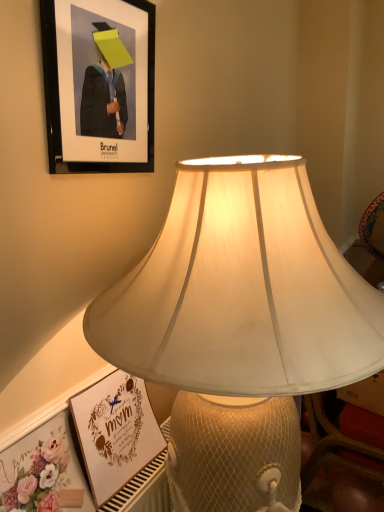
Question: Could you tell me if floral paper at lower left is facing matte white frame at lower left, the 1th picture frame when ordered from bottom to top?

Choices:
 (A) no
 (B) yes

Answer: (A)

Question: Is floral paper at lower left positioned before matte white frame at lower left, the 1th picture frame when ordered from bottom to top?

Choices:
 (A) no
 (B) yes

Answer: (B)

Question: From a real-world perspective, is floral paper at lower left below matte white frame at lower left, marked as the 2th picture frame in a top-to-bottom arrangement?

Choices:
 (A) yes
 (B) no

Answer: (A)

Question: From a real-world perspective, is floral paper at lower left over matte white frame at lower left, marked as the 2th picture frame in a top-to-bottom arrangement?

Choices:
 (A) yes
 (B) no

Answer: (B)

Question: Considering the relative positions of floral paper at lower left and matte white frame at lower left, marked as the 2th picture frame in a top-to-bottom arrangement, in the image provided, is floral paper at lower left to the right of matte white frame at lower left, marked as the 2th picture frame in a top-to-bottom arrangement, from the viewer's perspective?

Choices:
 (A) no
 (B) yes

Answer: (A)

Question: From the image's perspective, is floral paper at lower left on top of matte white frame at lower left, the 1th picture frame when ordered from bottom to top?

Choices:
 (A) yes
 (B) no

Answer: (B)

Question: Is black matte picture frame at upper left, marked as the 1th picture frame in a top-to-bottom arrangement, shorter than matte white frame at lower left, marked as the 2th picture frame in a top-to-bottom arrangement?

Choices:
 (A) no
 (B) yes

Answer: (A)

Question: From the image's perspective, is black matte picture frame at upper left, marked as the 2th picture frame in a bottom-to-top arrangement, beneath matte white frame at lower left, marked as the 2th picture frame in a top-to-bottom arrangement?

Choices:
 (A) no
 (B) yes

Answer: (A)

Question: Is black matte picture frame at upper left, marked as the 2th picture frame in a bottom-to-top arrangement, oriented towards matte white frame at lower left, marked as the 2th picture frame in a top-to-bottom arrangement?

Choices:
 (A) no
 (B) yes

Answer: (A)

Question: Is matte white frame at lower left, the 1th picture frame when ordered from bottom to top, completely or partially inside black matte picture frame at upper left, marked as the 1th picture frame in a top-to-bottom arrangement?

Choices:
 (A) yes
 (B) no

Answer: (B)

Question: Is black matte picture frame at upper left, marked as the 2th picture frame in a bottom-to-top arrangement, closer to camera compared to matte white frame at lower left, the 1th picture frame when ordered from bottom to top?

Choices:
 (A) yes
 (B) no

Answer: (A)

Question: Is there a large distance between black matte picture frame at upper left, marked as the 1th picture frame in a top-to-bottom arrangement, and matte white frame at lower left, marked as the 2th picture frame in a top-to-bottom arrangement?

Choices:
 (A) no
 (B) yes

Answer: (A)

Question: Is matte white lampshade at center further to the viewer compared to matte white frame at lower left, marked as the 2th picture frame in a top-to-bottom arrangement?

Choices:
 (A) yes
 (B) no

Answer: (B)